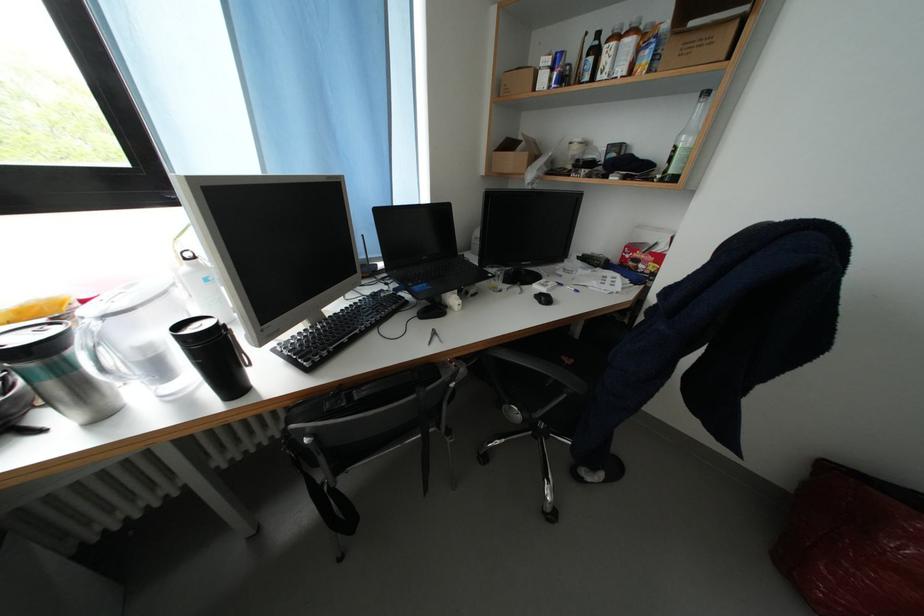
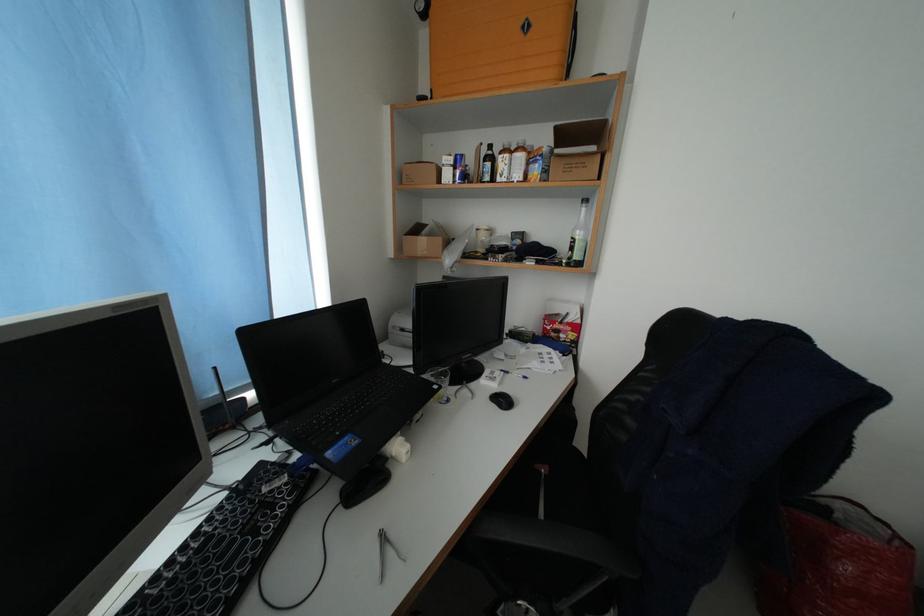
Locate, in the second image, the point that corresponds to point (553, 304) in the first image.

(512, 406)